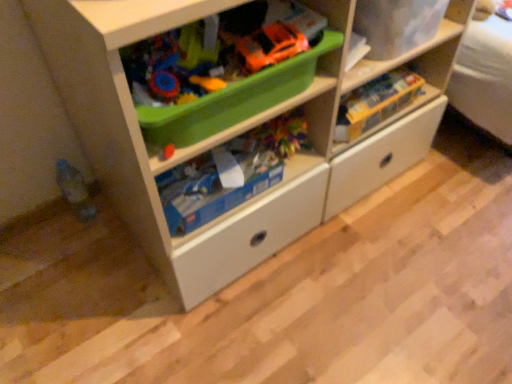
What do you see at coordinates (270, 46) in the screenshot?
I see `orange matte toy car at upper center` at bounding box center [270, 46].

The image size is (512, 384). In order to click on green plastic container at upper center in this screenshot , I will do `click(222, 66)`.

Measure the distance between point (152, 215) and camera.

Point (152, 215) and camera are 31.57 inches apart.

The width and height of the screenshot is (512, 384). What are the coordinates of `matte plastic toy at lower left, the first toy positioned from the left` in the screenshot? It's located at (x=74, y=190).

Where is `matte plastic storage box at upper right`? matte plastic storage box at upper right is located at coordinates (397, 25).

Measure the distance between yellow cardboard box at upper right, which ranks as the third toy in left-to-right order, and camera.

The distance of yellow cardboard box at upper right, which ranks as the third toy in left-to-right order, from camera is 3.46 feet.

Locate an element on the screen. Image resolution: width=512 pixels, height=384 pixels. orange matte toy car at upper center is located at coordinates (270, 46).

Considering the positions of points (194, 105) and (208, 170), is point (194, 105) farther from camera compared to point (208, 170)?

That is False.

Which of these two, green plastic container at upper center or blue cardboard box at center, the 2th toy when ordered from right to left, is bigger?

With larger size is green plastic container at upper center.

Which object is closer to the camera taking this photo, green plastic container at upper center or blue cardboard box at center, the 2th toy when ordered from right to left?

green plastic container at upper center is more forward.

Considering the positions of objects green plastic container at upper center and blue cardboard box at center, placed as the 2th toy when sorted from left to right, in the image provided, who is more to the right, green plastic container at upper center or blue cardboard box at center, placed as the 2th toy when sorted from left to right,?

green plastic container at upper center is more to the right.

Can you tell me how much matte plastic storage box at upper right and green plastic container at upper center differ in facing direction?

The facing directions of matte plastic storage box at upper right and green plastic container at upper center are 1.24 degrees apart.

Which object is thinner, matte plastic storage box at upper right or green plastic container at upper center?

Thinner between the two is matte plastic storage box at upper right.

Is matte plastic storage box at upper right next to green plastic container at upper center and touching it?

No, matte plastic storage box at upper right is not with green plastic container at upper center.

Considering the relative positions of matte plastic storage box at upper right and green plastic container at upper center in the image provided, is matte plastic storage box at upper right in front of green plastic container at upper center?

No, matte plastic storage box at upper right is further to the viewer.

The height and width of the screenshot is (384, 512). In order to click on shelf in front of the orange matte toy car at upper center in this screenshot , I will do `click(222, 66)`.

Consider the image. From the image's perspective, is orange matte toy car at upper center positioned above or below green plastic container at upper center?

orange matte toy car at upper center is situated higher than green plastic container at upper center in the image.

Is orange matte toy car at upper center not inside green plastic container at upper center?

Actually, orange matte toy car at upper center is at least partially inside green plastic container at upper center.

Which of these two, orange matte toy car at upper center or green plastic container at upper center, stands taller?

green plastic container at upper center.

From the image's perspective, is orange matte toy car at upper center located above or below matte plastic toy at lower left, the first toy positioned from the left?

Clearly, from the image's perspective, orange matte toy car at upper center is above matte plastic toy at lower left, the first toy positioned from the left.

Considering the sizes of orange matte toy car at upper center and matte plastic toy at lower left, the third toy from the right, in the image, is orange matte toy car at upper center taller or shorter than matte plastic toy at lower left, the third toy from the right,?

Clearly, orange matte toy car at upper center is shorter compared to matte plastic toy at lower left, the third toy from the right.

Is orange matte toy car at upper center wider or thinner than matte plastic toy at lower left, the first toy positioned from the left?

orange matte toy car at upper center is wider than matte plastic toy at lower left, the first toy positioned from the left.

Do you think white matte chest of drawers at center is within green plastic container at upper center, or outside of it?

white matte chest of drawers at center cannot be found inside green plastic container at upper center.

Considering the sizes of objects white matte chest of drawers at center and green plastic container at upper center in the image provided, who is thinner, white matte chest of drawers at center or green plastic container at upper center?

With smaller width is green plastic container at upper center.

Is white matte chest of drawers at center far from green plastic container at upper center?

No, white matte chest of drawers at center is not far from green plastic container at upper center.

Which of these two, white matte chest of drawers at center or green plastic container at upper center, is smaller?

green plastic container at upper center is smaller.

In terms of size, does matte plastic storage box at upper right appear bigger or smaller than white matte chest of drawers at center?

Clearly, matte plastic storage box at upper right is smaller in size than white matte chest of drawers at center.

Is matte plastic storage box at upper right wider than white matte chest of drawers at center?

No.

From a real-world perspective, which object rests below the other?

white matte chest of drawers at center is physically lower.

From the image's perspective, is green plastic container at upper center located above or below orange matte toy car at upper center?

From the image's perspective, green plastic container at upper center appears below orange matte toy car at upper center.

From a real-world perspective, between green plastic container at upper center and orange matte toy car at upper center, who is vertically higher?

orange matte toy car at upper center is physically above.

Considering the positions of points (199, 55) and (283, 39), is point (199, 55) farther from camera compared to point (283, 39)?

Yes.

Which of these two, green plastic container at upper center or orange matte toy car at upper center, stands shorter?

orange matte toy car at upper center.

The height and width of the screenshot is (384, 512). Identify the location of shelf above the blue cardboard box at center, the 2th toy when ordered from right to left (from a real-world perspective). (222, 66).

Locate an element on the screen. storage box below the green plastic container at upper center (from a real-world perspective) is located at coordinates (397, 25).

Which object lies further to the anchor point matte plastic toy at lower left, the first toy positioned from the left, matte plastic storage box at upper right or white matte chest of drawers at center?

Among the two, matte plastic storage box at upper right is located further to matte plastic toy at lower left, the first toy positioned from the left.

Considering their positions, is yellow cardboard box at upper right, which ranks as the third toy in left-to-right order, positioned closer to orange matte toy car at upper center than matte plastic toy at lower left, the third toy from the right?

yellow cardboard box at upper right, which ranks as the third toy in left-to-right order.

From the picture: Looking at the image, which one is located further to yellow cardboard box at upper right, which ranks as the third toy in left-to-right order, blue cardboard box at center, the 2th toy when ordered from right to left, or green plastic container at upper center?

green plastic container at upper center lies further to yellow cardboard box at upper right, which ranks as the third toy in left-to-right order, than the other object.

Estimate the real-world distances between objects in this image. Which object is further from matte plastic storage box at upper right, matte plastic toy at lower left, the first toy positioned from the left, or yellow cardboard box at upper right, which ranks as the third toy in left-to-right order?

matte plastic toy at lower left, the first toy positioned from the left, lies further to matte plastic storage box at upper right than the other object.

Looking at the image, which one is located further to matte plastic storage box at upper right, orange matte toy car at upper center or white matte chest of drawers at center?

white matte chest of drawers at center.

Looking at the image, which one is located further to white matte chest of drawers at center, yellow cardboard box at upper right, which ranks as the third toy in left-to-right order, or matte plastic storage box at upper right?

The object further to white matte chest of drawers at center is matte plastic storage box at upper right.

Which object lies nearer to the anchor point blue cardboard box at center, the 2th toy when ordered from right to left, yellow cardboard box at upper right, which ranks as the third toy in left-to-right order, or matte plastic toy at lower left, the third toy from the right?

The object closer to blue cardboard box at center, the 2th toy when ordered from right to left, is yellow cardboard box at upper right, which ranks as the third toy in left-to-right order.

Based on their spatial positions, is orange matte toy car at upper center or matte plastic toy at lower left, the first toy positioned from the left, closer to green plastic container at upper center?

orange matte toy car at upper center is positioned closer to the anchor green plastic container at upper center.

Identify the location of toy car between white matte chest of drawers at center and yellow cardboard box at upper right, which appears as the first toy when viewed from the right, from front to back. The image size is (512, 384). (270, 46).

Find the location of a particular element. chest of drawers between orange matte toy car at upper center and matte plastic storage box at upper right in the horizontal direction is located at coordinates (231, 133).

At what (x,y) coordinates should I click in order to perform the action: click on toy car between green plastic container at upper center and matte plastic storage box at upper right in the horizontal direction. Please return your answer as a coordinate pair (x, y). Looking at the image, I should click on (270, 46).

Where is `toy car between matte plastic toy at lower left, the first toy positioned from the left, and yellow cardboard box at upper right, which ranks as the third toy in left-to-right order`? The width and height of the screenshot is (512, 384). toy car between matte plastic toy at lower left, the first toy positioned from the left, and yellow cardboard box at upper right, which ranks as the third toy in left-to-right order is located at coordinates (270, 46).